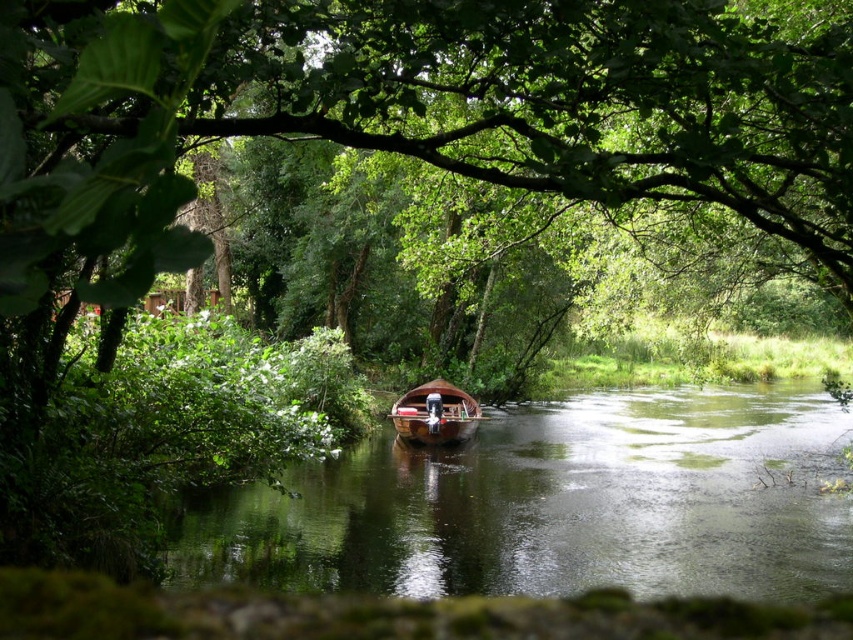
Question: Observing the image, what is the correct spatial positioning of green leafy tree at center in reference to wooden boat at center?

Choices:
 (A) above
 (B) below

Answer: (A)

Question: Where is brown wooden boat at center located in relation to wooden boat at center in the image?

Choices:
 (A) above
 (B) below

Answer: (B)

Question: Which of the following is the farthest from the observer?

Choices:
 (A) (537, 28)
 (B) (454, 433)

Answer: (B)

Question: Which of the following is the farthest from the observer?

Choices:
 (A) pyautogui.click(x=254, y=524)
 (B) pyautogui.click(x=3, y=234)

Answer: (A)

Question: Which point is closer to the camera?

Choices:
 (A) green leafy tree at center
 (B) wooden boat at center
 (C) brown wooden boat at center

Answer: (A)

Question: Is green leafy tree at center positioned in front of wooden boat at center?

Choices:
 (A) yes
 (B) no

Answer: (A)